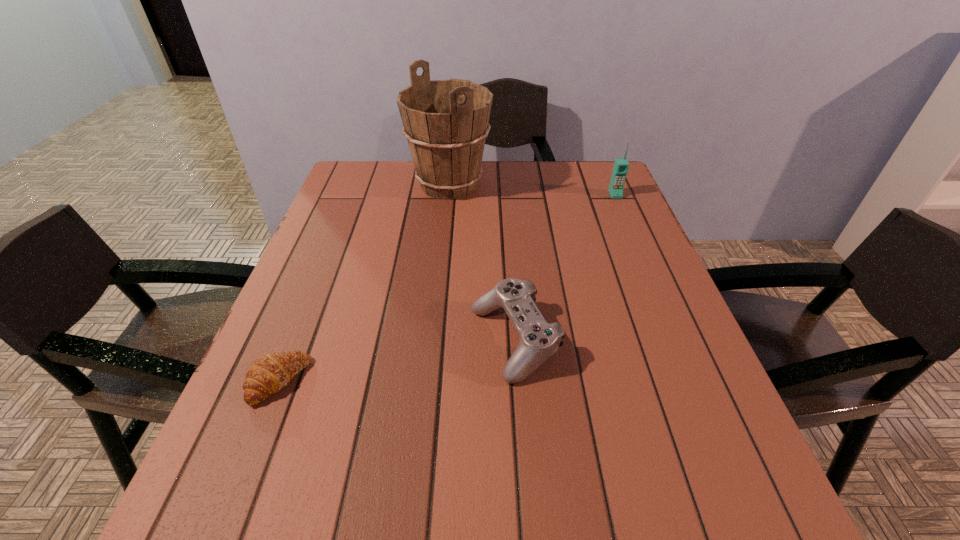
In order to click on empty space between the crescent roll and the control in this screenshot , I will do `click(396, 361)`.

I want to click on empty space that is in between the third tallest object and the rightmost object, so click(564, 268).

Identify which object is the third nearest to the cellular telephone. Please provide its 2D coordinates. Your answer should be formatted as a tuple, i.e. [(x, y)], where the tuple contains the x and y coordinates of a point satisfying the conditions above.

[(268, 374)]

Image resolution: width=960 pixels, height=540 pixels. I want to click on object that is the third closest to the second shortest object, so click(x=621, y=165).

Where is `free space that satisfies the following two spatial constraints: 1. on the back side of the tallest object; 2. on the left side of the crescent roll`? The height and width of the screenshot is (540, 960). free space that satisfies the following two spatial constraints: 1. on the back side of the tallest object; 2. on the left side of the crescent roll is located at coordinates (357, 185).